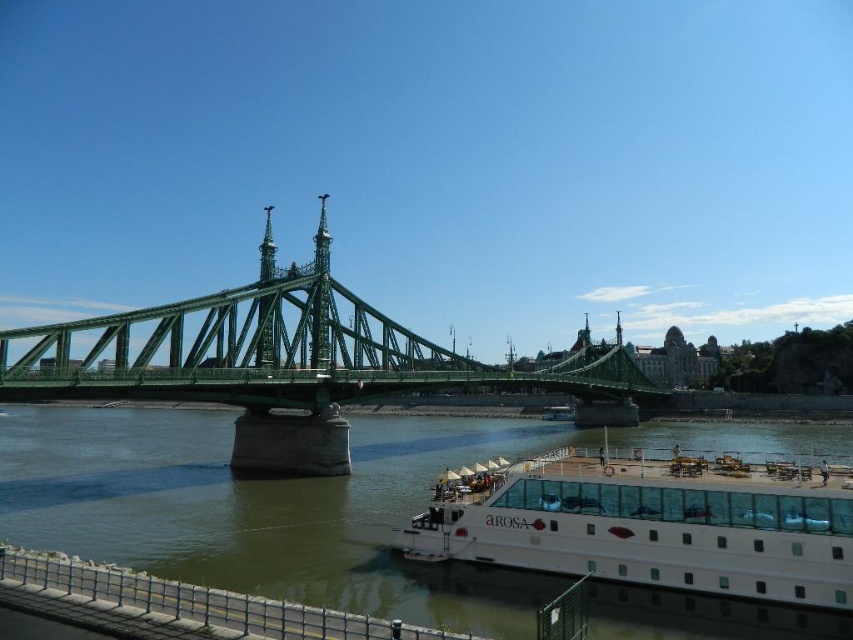
Question: Does green metallic bridge at center appear over white glassy cruise ship at lower right?

Choices:
 (A) yes
 (B) no

Answer: (A)

Question: Among these objects, which one is nearest to the camera?

Choices:
 (A) white glassy cruise ship at lower right
 (B) green metallic bridge at center

Answer: (A)

Question: Is green metallic water at lower center wider than green metallic bridge at center?

Choices:
 (A) no
 (B) yes

Answer: (B)

Question: Which object is positioned closest to the white glassy cruise ship at lower right?

Choices:
 (A) green metallic bridge at center
 (B) green metallic water at lower center

Answer: (B)

Question: Is green metallic bridge at center above white glassy cruise ship at lower right?

Choices:
 (A) yes
 (B) no

Answer: (A)

Question: Estimate the real-world distances between objects in this image. Which object is closer to the green metallic water at lower center?

Choices:
 (A) white glassy cruise ship at lower right
 (B) green metallic bridge at center

Answer: (A)